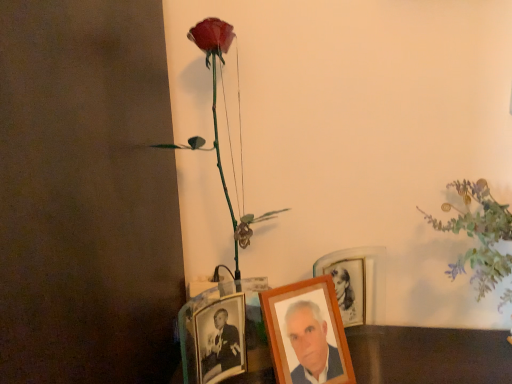
Question: Does metallic photo frame at lower center, placed as the third picture frame when sorted from right to left, have a greater height compared to wooden photo frame at center, the second picture frame viewed from the right?

Choices:
 (A) no
 (B) yes

Answer: (A)

Question: Is metallic photo frame at lower center, placed as the third picture frame when sorted from right to left, closer to camera compared to wooden photo frame at center, the 2th picture frame in the left-to-right sequence?

Choices:
 (A) no
 (B) yes

Answer: (B)

Question: Does metallic photo frame at lower center, positioned as the 1th picture frame in left-to-right order, have a lesser width compared to wooden photo frame at center, the second picture frame viewed from the right?

Choices:
 (A) yes
 (B) no

Answer: (B)

Question: Is metallic photo frame at lower center, positioned as the 1th picture frame in left-to-right order, to the right of wooden photo frame at center, the 2th picture frame in the left-to-right sequence, from the viewer's perspective?

Choices:
 (A) no
 (B) yes

Answer: (A)

Question: Is metallic photo frame at lower center, placed as the third picture frame when sorted from right to left, smaller than wooden photo frame at center, the second picture frame viewed from the right?

Choices:
 (A) yes
 (B) no

Answer: (B)

Question: Is metallic photo frame at lower center, placed as the third picture frame when sorted from right to left, in front of or behind wooden photo frame at center, which appears as the 1th picture frame when viewed from the right, in the image?

Choices:
 (A) behind
 (B) front

Answer: (B)

Question: Is point (203, 359) closer or farther from the camera than point (340, 256)?

Choices:
 (A) closer
 (B) farther

Answer: (A)

Question: In terms of height, does metallic photo frame at lower center, positioned as the 1th picture frame in left-to-right order, look taller or shorter compared to wooden photo frame at center, which appears as the 1th picture frame when viewed from the right?

Choices:
 (A) short
 (B) tall

Answer: (B)

Question: From the image's perspective, is metallic photo frame at lower center, placed as the third picture frame when sorted from right to left, positioned above or below wooden photo frame at center, which appears as the 1th picture frame when viewed from the right?

Choices:
 (A) below
 (B) above

Answer: (A)

Question: From the image's perspective, is matte green plant at upper right, the 2th floral arrangement from the left, located above or below wooden photo frame at center, the second picture frame viewed from the right?

Choices:
 (A) below
 (B) above

Answer: (B)

Question: Is matte green plant at upper right, arranged as the 1th floral arrangement when viewed from the right, wider or thinner than wooden photo frame at center, the second picture frame viewed from the right?

Choices:
 (A) wide
 (B) thin

Answer: (A)

Question: Is matte green plant at upper right, the 2th floral arrangement from the left, situated inside wooden photo frame at center, the second picture frame viewed from the right, or outside?

Choices:
 (A) inside
 (B) outside

Answer: (B)

Question: From a real-world perspective, is matte green plant at upper right, arranged as the 1th floral arrangement when viewed from the right, above or below wooden photo frame at center, the second picture frame viewed from the right?

Choices:
 (A) above
 (B) below

Answer: (A)

Question: In the image, is wooden photo frame at center, the third picture frame when ordered from left to right, on the left side or the right side of metallic photo frame at lower center, positioned as the 1th picture frame in left-to-right order?

Choices:
 (A) left
 (B) right

Answer: (B)

Question: In terms of width, does wooden photo frame at center, which appears as the 1th picture frame when viewed from the right, look wider or thinner when compared to metallic photo frame at lower center, placed as the third picture frame when sorted from right to left?

Choices:
 (A) wide
 (B) thin

Answer: (B)